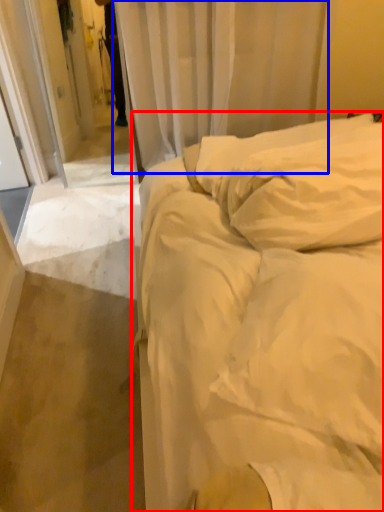
Question: Which point is closer to the camera, bed (highlighted by a red box) or curtain (highlighted by a blue box)?

Choices:
 (A) bed
 (B) curtain

Answer: (A)